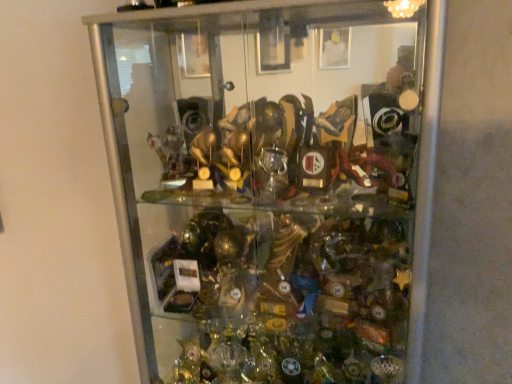
Describe the element at coordinates (274, 186) in the screenshot. I see `clear glass cabinet at center` at that location.

In order to click on clear glass cabinet at center in this screenshot , I will do `click(274, 186)`.

Find the location of a particular element. This screenshot has height=384, width=512. clear glass cabinet at center is located at coordinates (274, 186).